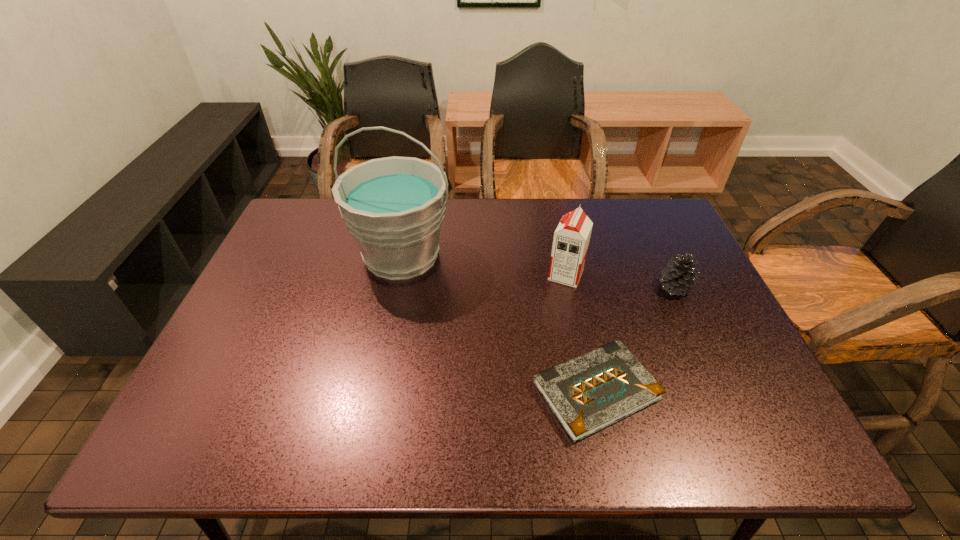
Identify the location of object identified as the closest to the leftmost object. This screenshot has width=960, height=540. (571, 239).

Where is `object that is the third closest to the soya milk`? object that is the third closest to the soya milk is located at coordinates (394, 206).

At what (x,y) coordinates should I click in order to perform the action: click on vacant space that satisfies the following two spatial constraints: 1. on the front side of the soya milk; 2. on the left side of the nearest object. Please return your answer as a coordinate pair (x, y). Looking at the image, I should click on (590, 391).

Where is `free spot that satisfies the following two spatial constraints: 1. on the front side of the leftmost object; 2. on the left side of the shortest object`? free spot that satisfies the following two spatial constraints: 1. on the front side of the leftmost object; 2. on the left side of the shortest object is located at coordinates (374, 391).

The width and height of the screenshot is (960, 540). What are the coordinates of `vacant point that satisfies the following two spatial constraints: 1. on the front side of the leftmost object; 2. on the right side of the soya milk` in the screenshot? It's located at (397, 275).